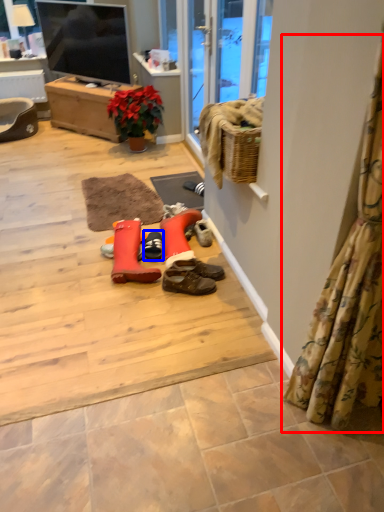
Question: Which object appears farthest to the camera in this image, curtain (highlighted by a red box) or footwear (highlighted by a blue box)?

Choices:
 (A) curtain
 (B) footwear

Answer: (B)